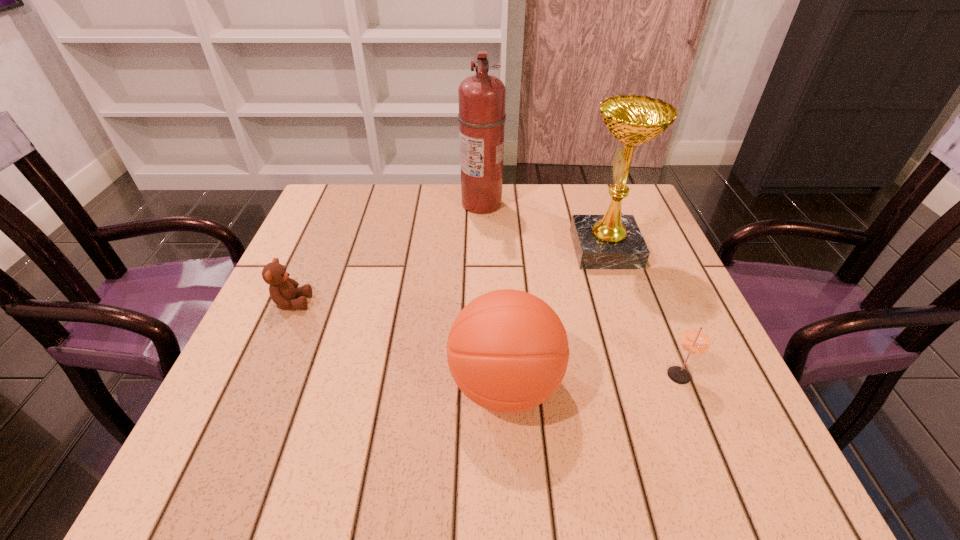
Locate an element on the screen. This screenshot has height=540, width=960. the farthest object is located at coordinates (481, 97).

Identify the location of fire extinguisher. (481, 97).

This screenshot has height=540, width=960. I want to click on the second farthest object, so click(612, 241).

Find the location of `award`. award is located at coordinates (612, 241).

The image size is (960, 540). Identify the location of the third tallest object. (507, 350).

Identify the location of the fourth tallest object. (695, 340).

Where is `the third nearest object`? This screenshot has height=540, width=960. the third nearest object is located at coordinates [283, 290].

The height and width of the screenshot is (540, 960). In order to click on teddy bear in this screenshot , I will do `click(283, 290)`.

Locate an element on the screen. vacant position located 0.080m on the front-facing side of the farthest object is located at coordinates (431, 204).

I want to click on blank space located 0.110m on the front-facing side of the farthest object, so click(420, 204).